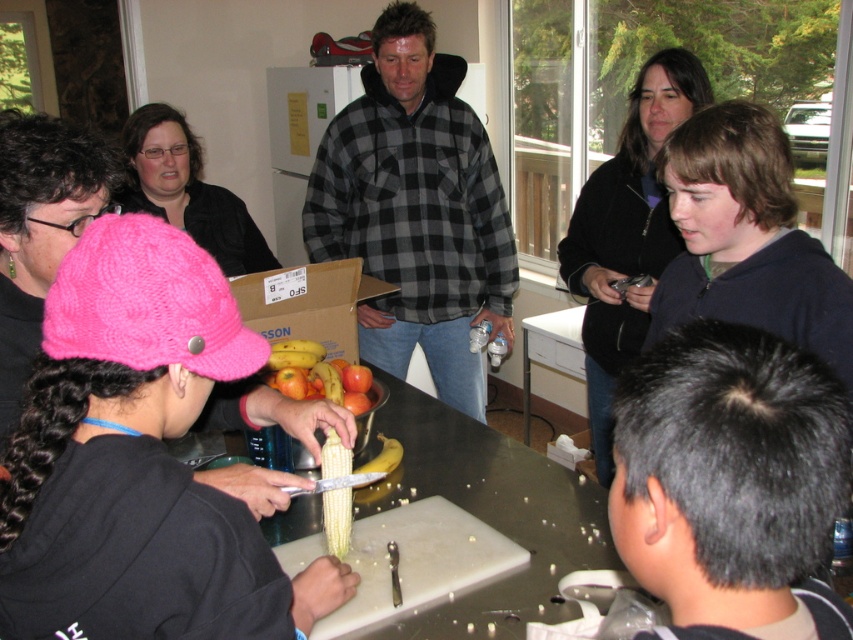
Question: Which object is positioned closest to the yellow matte banana at center?

Choices:
 (A) dark gray hair at lower right
 (B) dark blue hoodie at right
 (C) yellow corn at center

Answer: (C)

Question: Which of the following is the closest to the observer?

Choices:
 (A) black checkered shirt at center
 (B) dark blue hoodie at right
 (C) dark gray hair at lower right
 (D) yellow corn at center

Answer: (C)

Question: Among these objects, which one is nearest to the camera?

Choices:
 (A) dark gray hair at lower right
 (B) black checkered shirt at center

Answer: (A)

Question: Is dark gray hair at lower right wider than dark blue hoodie at right?

Choices:
 (A) yes
 (B) no

Answer: (B)

Question: Is dark gray hair at lower right in front of yellow matte banana at center?

Choices:
 (A) no
 (B) yes

Answer: (B)

Question: Can you confirm if dark blue hoodie at right is positioned below yellow corn at center?

Choices:
 (A) no
 (B) yes

Answer: (A)